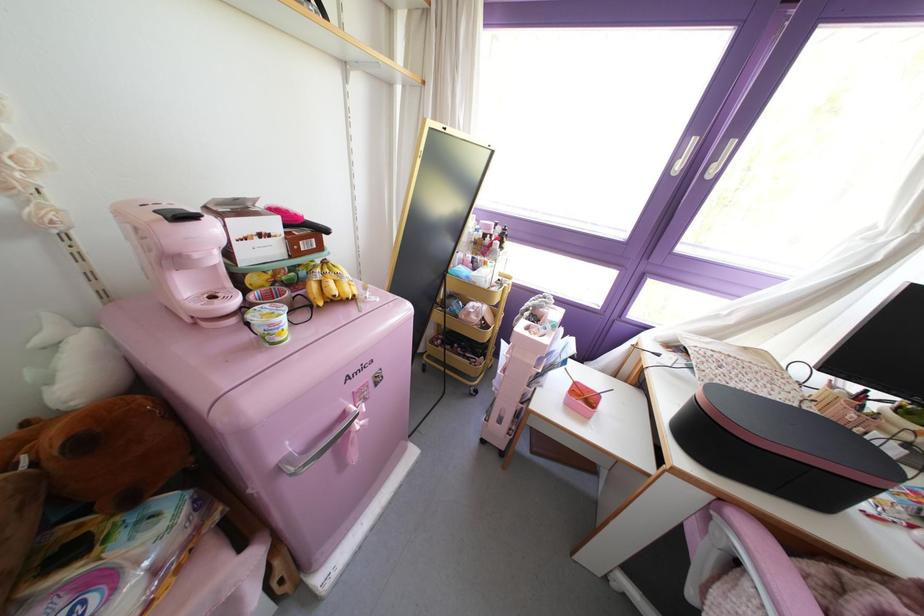
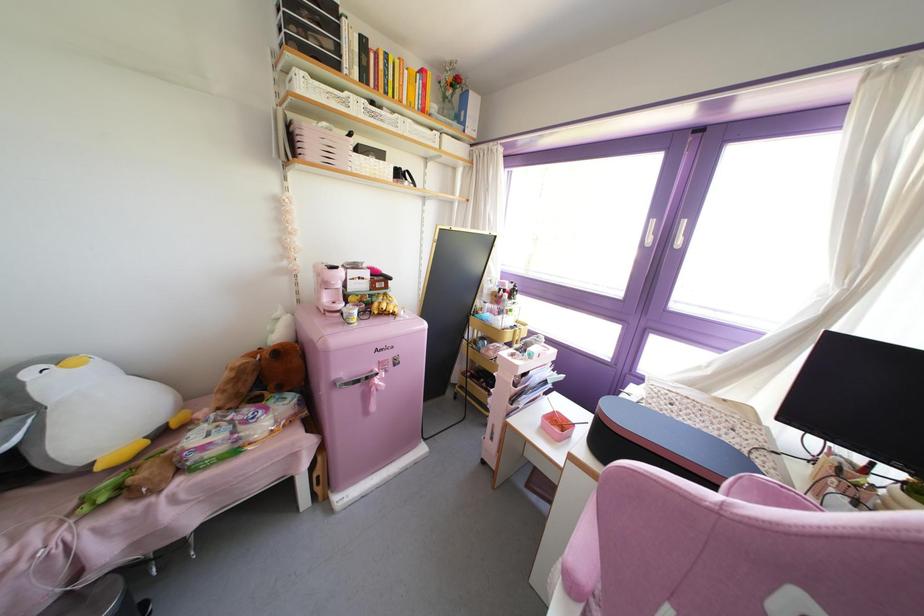
Find the pixel in the second image that matches point 586,387 in the first image.

(565, 418)